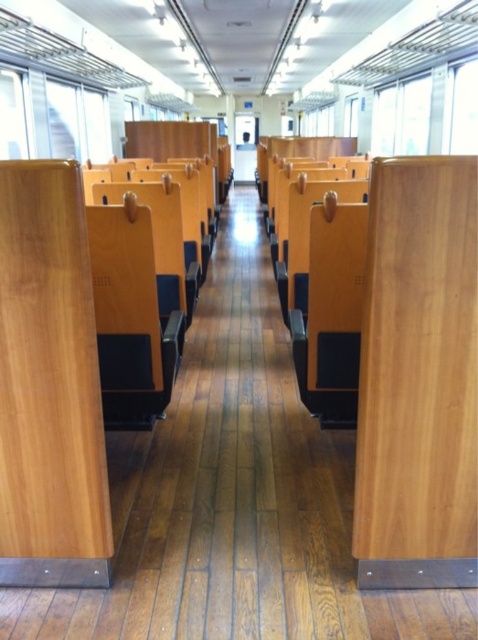
Is wooden chair at center to the right of wooden seat at center from the viewer's perspective?

No, wooden chair at center is not to the right of wooden seat at center.

Is wooden chair at center taller than wooden seat at center?

In fact, wooden chair at center may be shorter than wooden seat at center.

This screenshot has height=640, width=478. What do you see at coordinates (130, 317) in the screenshot? I see `wooden chair at center` at bounding box center [130, 317].

This screenshot has width=478, height=640. Identify the location of wooden chair at center. (130, 317).